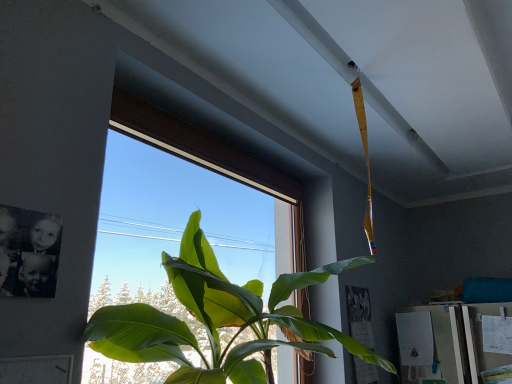
Question: From their relative heights in the image, would you say transparent glass window at center is taller or shorter than green leafy plant at center?

Choices:
 (A) short
 (B) tall

Answer: (B)

Question: Is point (295, 253) positioned closer to the camera than point (259, 304)?

Choices:
 (A) closer
 (B) farther

Answer: (B)

Question: Based on their positions, is transparent glass window at center located to the left or right of green leafy plant at center?

Choices:
 (A) right
 (B) left

Answer: (B)

Question: Does point (199, 375) appear closer or farther from the camera than point (209, 140)?

Choices:
 (A) farther
 (B) closer

Answer: (B)

Question: From the image's perspective, is green leafy plant at center located above or below transparent glass window at center?

Choices:
 (A) below
 (B) above

Answer: (A)

Question: Visually, is green leafy plant at center positioned to the left or to the right of transparent glass window at center?

Choices:
 (A) left
 (B) right

Answer: (B)

Question: From a real-world perspective, is green leafy plant at center positioned above or below transparent glass window at center?

Choices:
 (A) above
 (B) below

Answer: (B)